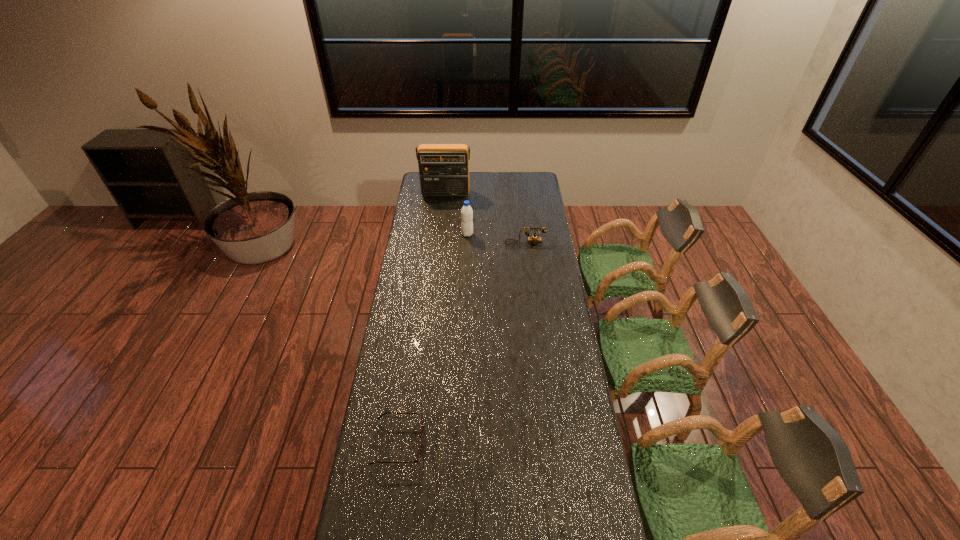
Identify the location of vacant area between the second shortest object and the radio receiver. This screenshot has height=540, width=960. (485, 219).

You are a GUI agent. You are given a task and a screenshot of the screen. Output one action in this format:
    pyautogui.click(x=<x>, y=<y>)
    Task: Click on the empty location between the spectacles and the telephone
    The height and width of the screenshot is (540, 960).
    Given the screenshot: What is the action you would take?
    pyautogui.click(x=462, y=343)

Where is `object that is the third closest one to the radio receiver`? The height and width of the screenshot is (540, 960). object that is the third closest one to the radio receiver is located at coordinates (417, 460).

Identify the location of object that is the third closest one to the radio receiver. This screenshot has width=960, height=540. (417, 460).

Locate an element on the screen. The image size is (960, 540). free spot that satisfies the following two spatial constraints: 1. on the front-facing side of the farthest object; 2. on the lenses of the spectacles is located at coordinates (420, 443).

This screenshot has height=540, width=960. What are the coordinates of `vacant space that satisfies the following two spatial constraints: 1. on the front-facing side of the rightmost object; 2. on the lenses of the spectacles` in the screenshot? It's located at (549, 443).

Locate an element on the screen. This screenshot has height=540, width=960. vacant space that satisfies the following two spatial constraints: 1. on the front-facing side of the radio receiver; 2. on the lenses of the nearest object is located at coordinates (420, 443).

The width and height of the screenshot is (960, 540). I want to click on vacant area in the image that satisfies the following two spatial constraints: 1. on the front-facing side of the radio receiver; 2. on the lenses of the nearest object, so click(420, 443).

Where is `vacant position in the image that satisfies the following two spatial constraints: 1. on the front-facing side of the third nearest object; 2. on the right side of the tallest object`? This screenshot has width=960, height=540. vacant position in the image that satisfies the following two spatial constraints: 1. on the front-facing side of the third nearest object; 2. on the right side of the tallest object is located at coordinates (442, 234).

The height and width of the screenshot is (540, 960). I want to click on vacant area that satisfies the following two spatial constraints: 1. on the front-facing side of the radio receiver; 2. on the lenses of the nearest object, so click(420, 443).